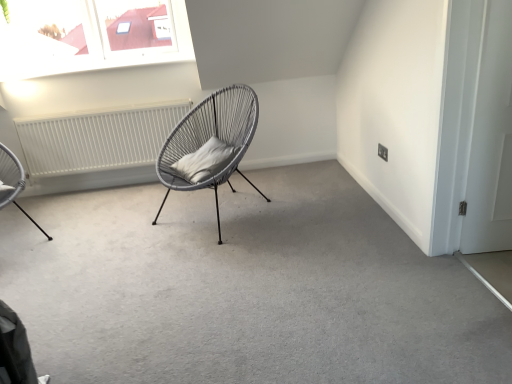
Question: Is white matte door at right to the left or to the right of matte grey wicker chair at center, which is counted as the 1th chair, starting from the right, in the image?

Choices:
 (A) right
 (B) left

Answer: (A)

Question: Is white matte door at right spatially inside matte grey wicker chair at center, which appears as the 2th chair when viewed from the left, or outside of it?

Choices:
 (A) inside
 (B) outside

Answer: (B)

Question: Which is nearer to the white matte radiator at left?

Choices:
 (A) matte grey wicker chair at center, which is counted as the 1th chair, starting from the right
 (B) gray fabric pillow at center
 (C) metallic wire chair at left, which is the 1th chair from left to right
 (D) white matte door at right

Answer: (A)

Question: Which of these objects is positioned farthest from the metallic wire chair at left, which is the 1th chair from left to right?

Choices:
 (A) matte grey wicker chair at center, which appears as the 2th chair when viewed from the left
 (B) white matte radiator at left
 (C) gray fabric pillow at center
 (D) white matte door at right

Answer: (D)